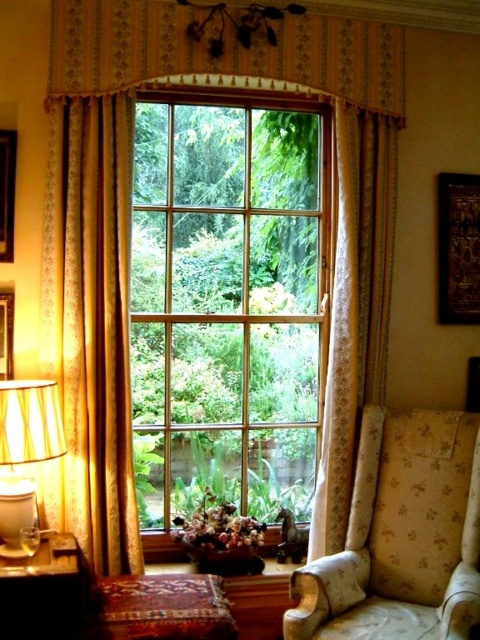
Can you confirm if wooden picture frame at left is bigger than matte black picture frame at left?

Yes.

Which is behind, point (1, 164) or point (9, 336)?

The point (9, 336) is behind.

Find the location of `wooden picture frame at left`. wooden picture frame at left is located at coordinates (7, 193).

Is clear glass window at center positioned before wooden picture frame at left?

No, clear glass window at center is further to the viewer.

Does clear glass window at center have a greater height compared to wooden picture frame at left?

Yes.

Describe the element at coordinates (228, 305) in the screenshot. This screenshot has width=480, height=640. I see `clear glass window at center` at that location.

In order to click on clear glass window at center in this screenshot , I will do `click(228, 305)`.

Is point (400, 449) less distant than point (28, 401)?

No, it is behind (28, 401).

Based on the photo, who is more forward, (360, 464) or (29, 515)?

Positioned in front is point (29, 515).

Where is `floral fabric armchair at lower right`? This screenshot has width=480, height=640. floral fabric armchair at lower right is located at coordinates (400, 536).